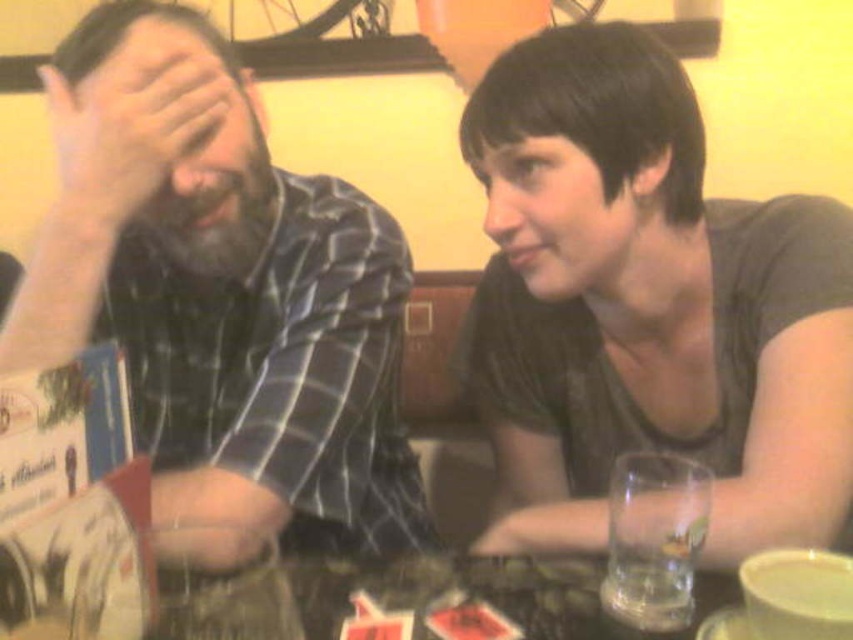
Consider the image. Is plaid shirt at left bigger than yellow matte cup at lower right?

Correct, plaid shirt at left is larger in size than yellow matte cup at lower right.

Who is higher up, plaid shirt at left or yellow matte cup at lower right?

plaid shirt at left is higher up.

I want to click on plaid shirt at left, so click(x=222, y=291).

Does dark gray shirt at center come in front of plaid shirt at left?

No.

Between point (563, 182) and point (169, 120), which one is positioned behind?

Point (563, 182)

This screenshot has height=640, width=853. Describe the element at coordinates (648, 305) in the screenshot. I see `dark gray shirt at center` at that location.

Where is `dark gray shirt at center`? dark gray shirt at center is located at coordinates (648, 305).

Describe the element at coordinates (798, 595) in the screenshot. I see `yellow matte cup at lower right` at that location.

Is yellow matte cup at lower right to the right of clear glass at lower right from the viewer's perspective?

Indeed, yellow matte cup at lower right is positioned on the right side of clear glass at lower right.

Is point (746, 582) closer to viewer compared to point (660, 577)?

That is True.

This screenshot has width=853, height=640. In order to click on yellow matte cup at lower right in this screenshot , I will do `click(798, 595)`.